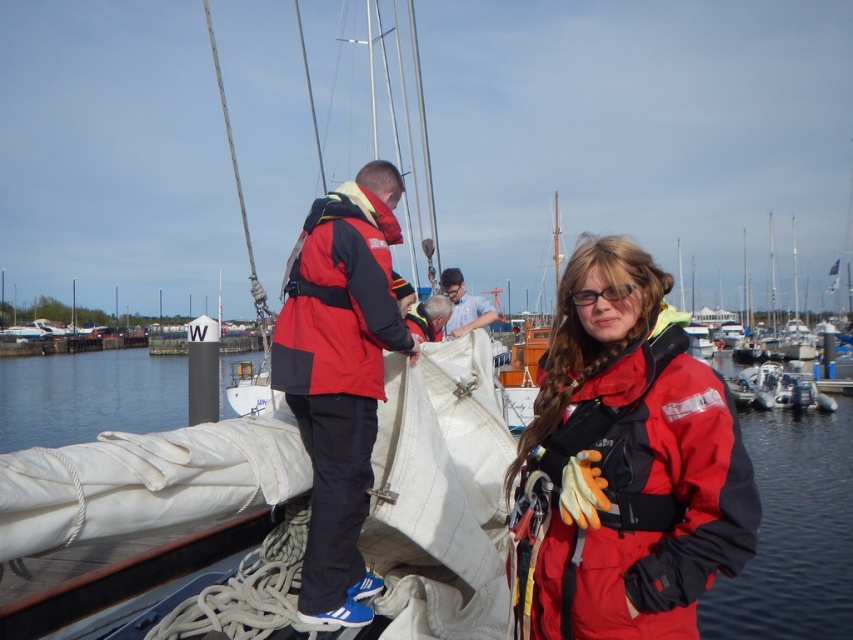
Question: Considering the relative positions of white fabric at center and red matte jacket at center in the image provided, where is white fabric at center located with respect to red matte jacket at center?

Choices:
 (A) below
 (B) above

Answer: (A)

Question: Which object appears closest to the camera in this image?

Choices:
 (A) matte white sail at center
 (B) red matte jacket at center

Answer: (B)

Question: Which object is closer to the camera taking this photo?

Choices:
 (A) white fabric at center
 (B) matte red jacket at center
 (C) matte white sail at center

Answer: (A)

Question: Does matte red jacket at center have a greater width compared to white fabric at center?

Choices:
 (A) yes
 (B) no

Answer: (B)

Question: Which of the following is the closest to the observer?

Choices:
 (A) (463, 317)
 (B) (345, 355)

Answer: (B)

Question: Can you confirm if white fabric at center is positioned to the right of red matte jacket at center?

Choices:
 (A) yes
 (B) no

Answer: (B)